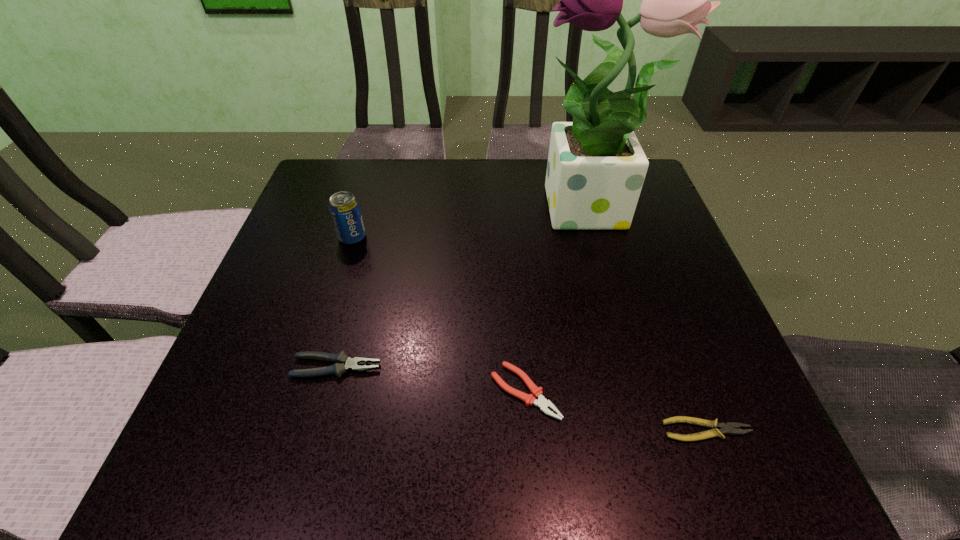
Identify the location of free spot between the second pliers from right to left and the soda. (439, 314).

Image resolution: width=960 pixels, height=540 pixels. I want to click on vacant space that's between the second pliers from right to left and the rightmost pliers, so click(616, 411).

At what (x,y) coordinates should I click in order to perform the action: click on vacant space that's between the rightmost pliers and the tallest object. Please return your answer as a coordinate pair (x, y). Image resolution: width=960 pixels, height=540 pixels. Looking at the image, I should click on (649, 321).

The width and height of the screenshot is (960, 540). What are the coordinates of `unoccupied area between the fourth tallest object and the flower arrangement` in the screenshot? It's located at (558, 302).

This screenshot has height=540, width=960. In order to click on empty space that is in between the shortest object and the soda in this screenshot , I will do `click(530, 334)`.

You are a GUI agent. You are given a task and a screenshot of the screen. Output one action in this format:
    pyautogui.click(x=<x>, y=<y>)
    Task: Click on the free space between the flower arrangement and the second shortest object
    
    Given the screenshot: What is the action you would take?
    pyautogui.click(x=558, y=302)

Where is `object that ranks as the closest to the shortest pliers`? The height and width of the screenshot is (540, 960). object that ranks as the closest to the shortest pliers is located at coordinates (530, 399).

Locate which object ranks third in proximity to the second tallest pliers. Please provide its 2D coordinates. Your answer should be formatted as a tuple, i.e. [(x, y)], where the tuple contains the x and y coordinates of a point satisfying the conditions above.

[(596, 168)]

At what (x,y) coordinates should I click in order to perform the action: click on pliers that is the third closest one to the tallest object. Please return your answer as a coordinate pair (x, y). The image size is (960, 540). Looking at the image, I should click on (343, 363).

Select which pliers appears as the closest to the soda. Please provide its 2D coordinates. Your answer should be formatted as a tuple, i.e. [(x, y)], where the tuple contains the x and y coordinates of a point satisfying the conditions above.

[(343, 363)]